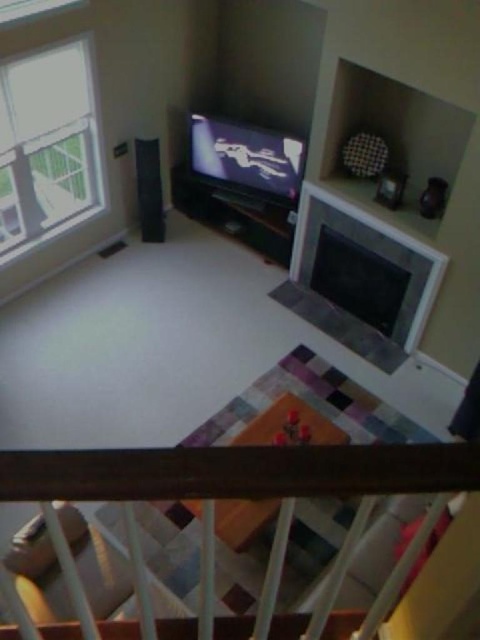
Question: Can you confirm if brown wooden rail at upper center is positioned below clear glass window at upper left?

Choices:
 (A) no
 (B) yes

Answer: (B)

Question: Among these objects, which one is nearest to the camera?

Choices:
 (A) matte black flat screen tv at center
 (B) brown wooden rail at upper center
 (C) clear glass window at upper left

Answer: (B)

Question: Is the position of clear glass window at upper left less distant than that of matte black flat screen tv at center?

Choices:
 (A) no
 (B) yes

Answer: (B)

Question: Is clear glass window at upper left to the right of matte black flat screen tv at center from the viewer's perspective?

Choices:
 (A) no
 (B) yes

Answer: (A)

Question: Which object is the farthest from the brown wooden rail at upper center?

Choices:
 (A) matte black flat screen tv at center
 (B) clear glass window at upper left

Answer: (A)

Question: Which is nearer to the clear glass window at upper left?

Choices:
 (A) matte black flat screen tv at center
 (B) brown wooden rail at upper center

Answer: (A)